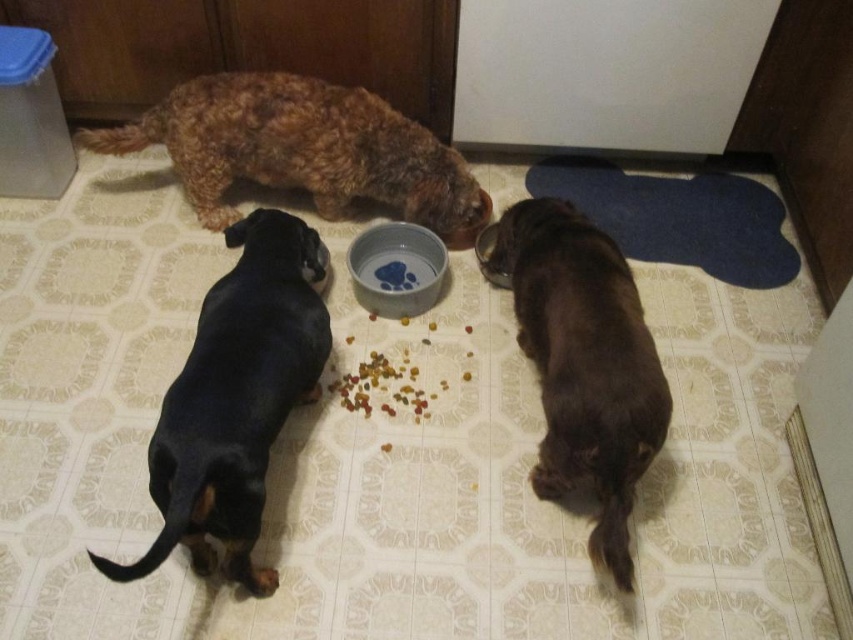
Does point (397, 244) lie in front of point (485, 262)?

No, (397, 244) is behind (485, 262).

Can you confirm if blue glossy bowl at center is bigger than metallic silver bowl at center?

Correct, blue glossy bowl at center is larger in size than metallic silver bowl at center.

Between point (396, 232) and point (485, 232), which one is positioned behind?

The point (485, 232) is more distant.

Find the location of a particular element. This screenshot has height=640, width=853. blue glossy bowl at center is located at coordinates (396, 268).

Is fuzzy brown dog at upper left closer to the viewer compared to blue glossy bowl at center?

No, fuzzy brown dog at upper left is further to the viewer.

Does fuzzy brown dog at upper left have a greater height compared to blue glossy bowl at center?

Yes, fuzzy brown dog at upper left is taller than blue glossy bowl at center.

Is point (213, 177) closer to camera compared to point (428, 282)?

Yes, it is.

In order to click on fuzzy brown dog at upper left in this screenshot , I will do `click(302, 148)`.

Is brown furry dog at lower right to the right of blue glossy bowl at center from the viewer's perspective?

Correct, you'll find brown furry dog at lower right to the right of blue glossy bowl at center.

Can you confirm if brown furry dog at lower right is taller than blue glossy bowl at center?

Correct, brown furry dog at lower right is much taller as blue glossy bowl at center.

Is point (575, 384) positioned in front of point (415, 266)?

Yes, it is in front of point (415, 266).

Where is `brown furry dog at lower right`? This screenshot has height=640, width=853. brown furry dog at lower right is located at coordinates (585, 364).